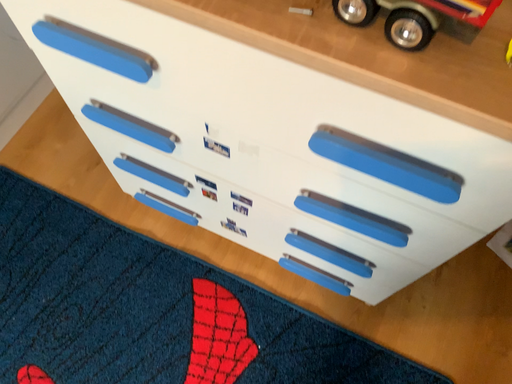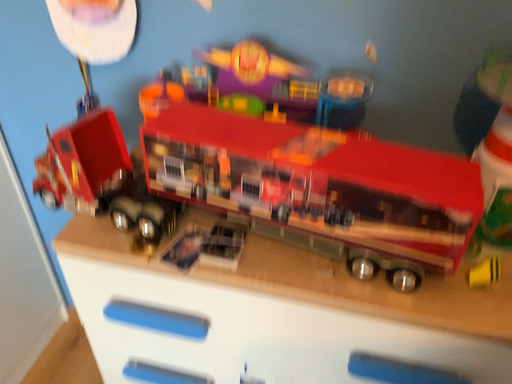
Question: Which way did the camera rotate in the video?

Choices:
 (A) rotated upward
 (B) rotated downward

Answer: (A)